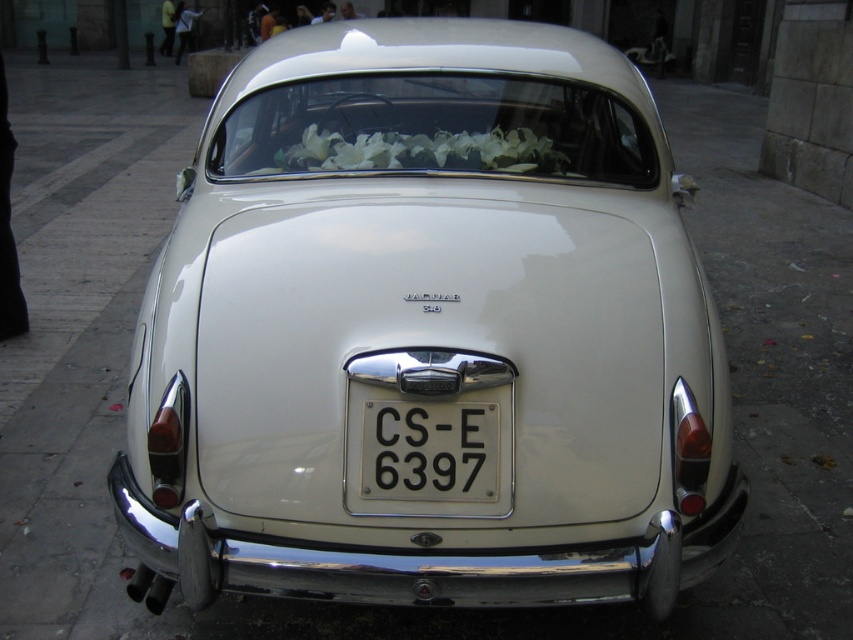
Question: Estimate the real-world distances between objects in this image. Which object is closer to the satin white car at center?

Choices:
 (A) white floral garland at center
 (B) black metal license plate at center

Answer: (B)

Question: Is satin white car at center behind white floral garland at center?

Choices:
 (A) no
 (B) yes

Answer: (A)

Question: Is satin white car at center positioned before black metal license plate at center?

Choices:
 (A) no
 (B) yes

Answer: (B)

Question: Which object is the farthest from the white floral garland at center?

Choices:
 (A) black metal license plate at center
 (B) satin white car at center

Answer: (A)

Question: Where is satin white car at center located in relation to white floral garland at center in the image?

Choices:
 (A) left
 (B) right

Answer: (B)

Question: Which object appears farthest from the camera in this image?

Choices:
 (A) satin white car at center
 (B) white floral garland at center

Answer: (B)